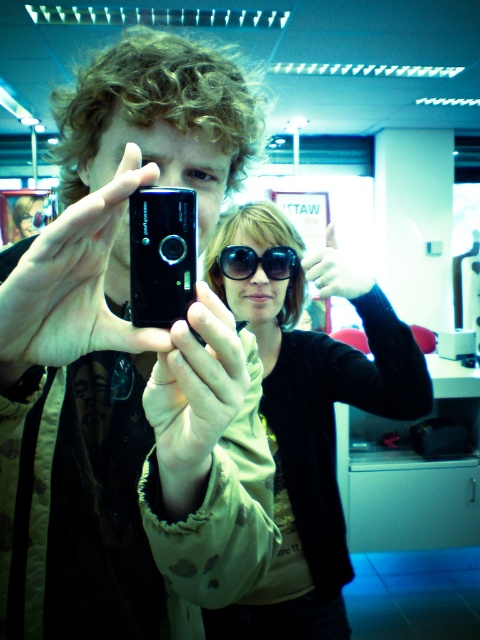
You are trying to take a photo with the matte black phone at center and the black shiny sunglasses at center in the frame. Which object will be more visible in the photo?

The matte black phone at center will be more visible in the photo because it is in front of the black shiny sunglasses at center, so it will appear in front and thus more prominent in the image.

You are a photographer trying to capture a clear shot of the matte black phone at center and the matte black hand at center. Which object is positioned in front of the other in the image?

The matte black phone at center is closer to the viewer than the matte black hand at center, so it is positioned in front of the matte black hand at center.